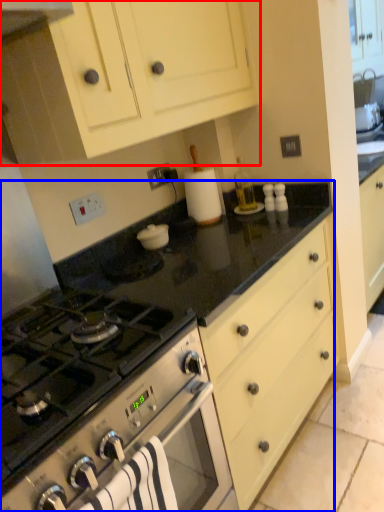
Question: Which object is closer to the camera taking this photo, cabinetry (highlighted by a red box) or countertop (highlighted by a blue box)?

Choices:
 (A) cabinetry
 (B) countertop

Answer: (A)